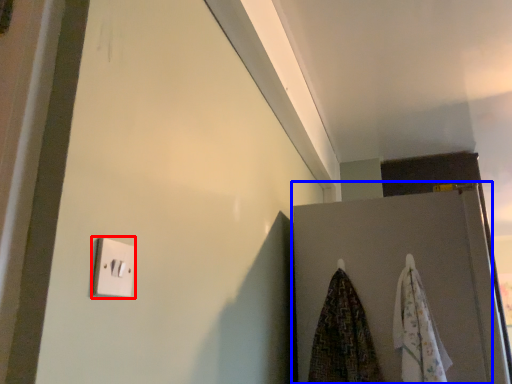
Question: Among these objects, which one is farthest to the camera, light switch (highlighted by a red box) or door (highlighted by a blue box)?

Choices:
 (A) light switch
 (B) door

Answer: (B)